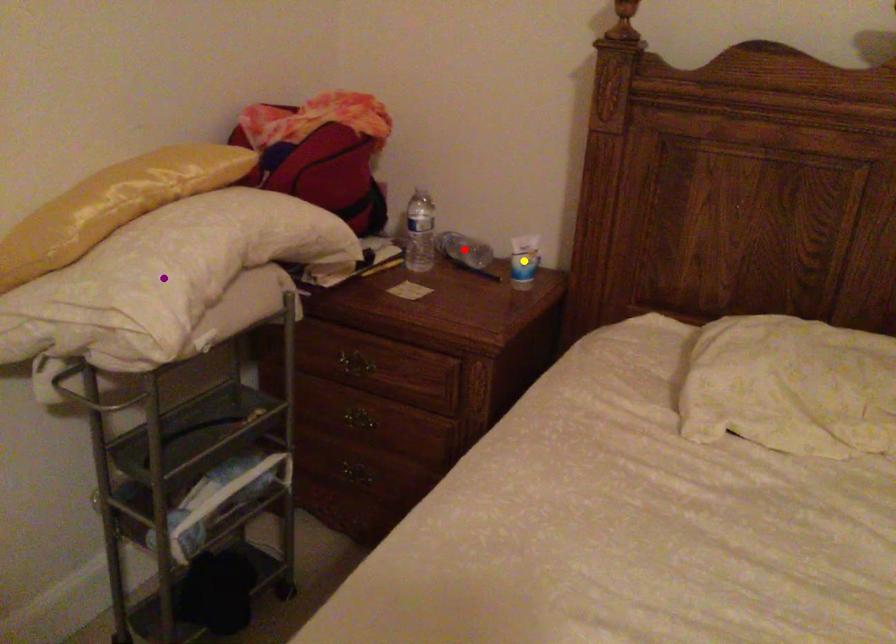
Order these from nearest to farthest:
yellow point
red point
purple point

purple point, yellow point, red point